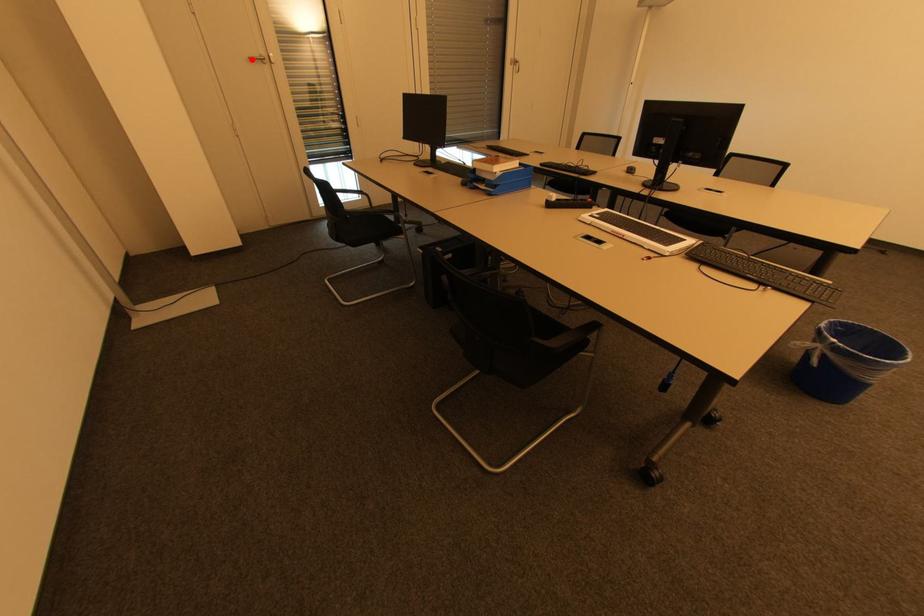
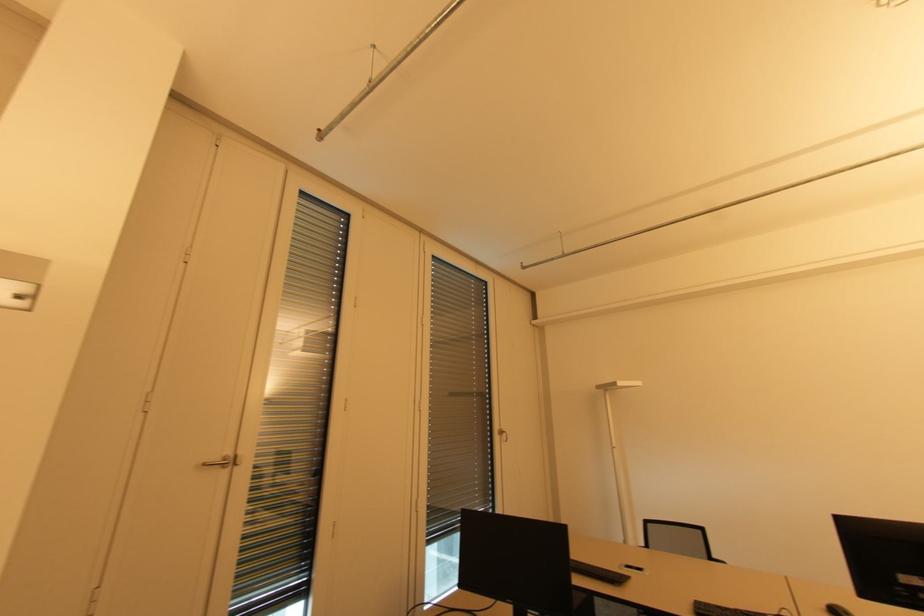
Locate, in the second image, the point that corresponds to the highlighted location in the first image.

(207, 464)